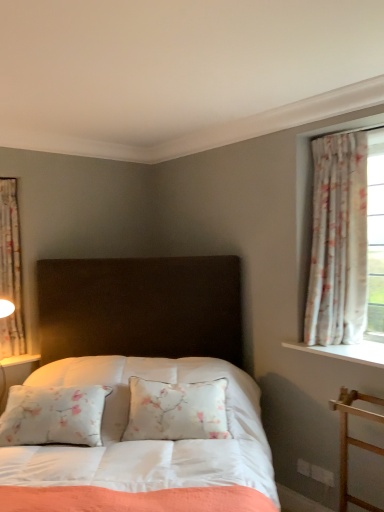
Question: Considering the relative positions of floral fabric curtain at left, placed as the 2th curtain when sorted from right to left, and floral fabric curtain at right, placed as the first curtain when sorted from right to left, in the image provided, is floral fabric curtain at left, placed as the 2th curtain when sorted from right to left, behind floral fabric curtain at right, placed as the first curtain when sorted from right to left,?

Choices:
 (A) yes
 (B) no

Answer: (A)

Question: Is floral fabric curtain at left, the first curtain when ordered from back to front, taller than floral fabric curtain at right, which is the second curtain from left to right?

Choices:
 (A) no
 (B) yes

Answer: (A)

Question: Is floral fabric curtain at left, the first curtain when ordered from back to front, bigger than floral fabric curtain at right, positioned as the 1th curtain in front-to-back order?

Choices:
 (A) yes
 (B) no

Answer: (B)

Question: Does floral fabric curtain at left, the first curtain when ordered from back to front, have a greater width compared to floral fabric curtain at right, the 2th curtain positioned from the back?

Choices:
 (A) yes
 (B) no

Answer: (B)

Question: Would you say floral fabric curtain at right, placed as the first curtain when sorted from right to left, is part of floral fabric curtain at left, the first curtain when ordered from back to front,'s contents?

Choices:
 (A) no
 (B) yes

Answer: (A)

Question: Is floral fabric curtain at right, placed as the first curtain when sorted from right to left, to the left or to the right of floral fabric curtain at left, acting as the second curtain starting from the front, in the image?

Choices:
 (A) left
 (B) right

Answer: (B)

Question: Is floral fabric curtain at right, which is the second curtain from left to right, spatially inside floral fabric curtain at left, acting as the second curtain starting from the front, or outside of it?

Choices:
 (A) inside
 (B) outside

Answer: (B)

Question: From the image's perspective, is floral fabric curtain at right, which is the second curtain from left to right, above or below floral fabric curtain at left, acting as the first curtain starting from the left?

Choices:
 (A) above
 (B) below

Answer: (A)

Question: Does point (344, 135) appear closer or farther from the camera than point (3, 266)?

Choices:
 (A) farther
 (B) closer

Answer: (B)

Question: Looking at their shapes, would you say floral fabric curtain at left, placed as the 2th curtain when sorted from right to left, is wider or thinner than floral fabric curtain at right, positioned as the 1th curtain in front-to-back order?

Choices:
 (A) wide
 (B) thin

Answer: (B)

Question: Based on their positions, is floral fabric curtain at left, acting as the second curtain starting from the front, located to the left or right of floral fabric curtain at right, the 2th curtain positioned from the back?

Choices:
 (A) right
 (B) left

Answer: (B)

Question: From a real-world perspective, is floral fabric curtain at left, acting as the second curtain starting from the front, physically located above or below floral fabric curtain at right, positioned as the 1th curtain in front-to-back order?

Choices:
 (A) above
 (B) below

Answer: (B)

Question: Considering the positions of floral fabric curtain at left, acting as the second curtain starting from the front, and floral fabric curtain at right, placed as the first curtain when sorted from right to left, in the image, is floral fabric curtain at left, acting as the second curtain starting from the front, taller or shorter than floral fabric curtain at right, placed as the first curtain when sorted from right to left,?

Choices:
 (A) tall
 (B) short

Answer: (B)

Question: Looking at their shapes, would you say satin white bed at center is wider or thinner than floral fabric curtain at left, the first curtain when ordered from back to front?

Choices:
 (A) wide
 (B) thin

Answer: (A)

Question: From the image's perspective, is satin white bed at center located above or below floral fabric curtain at left, placed as the 2th curtain when sorted from right to left?

Choices:
 (A) below
 (B) above

Answer: (A)